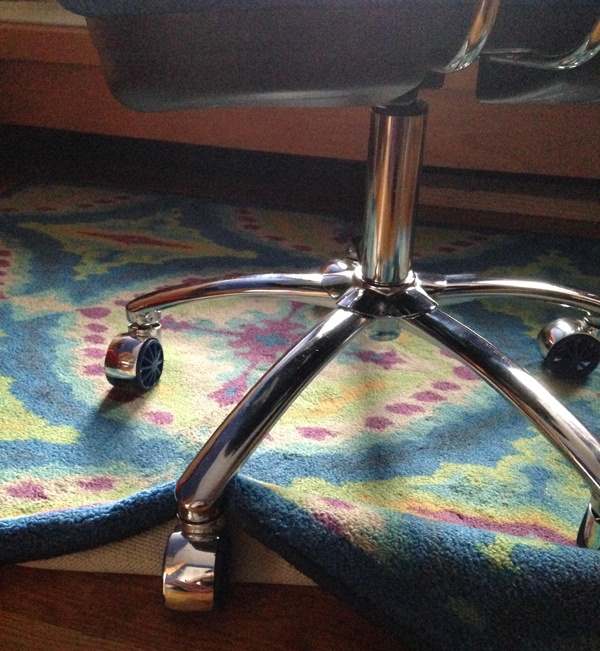
Locate an element on the screen. The image size is (600, 651). chair is located at coordinates (221, 57).